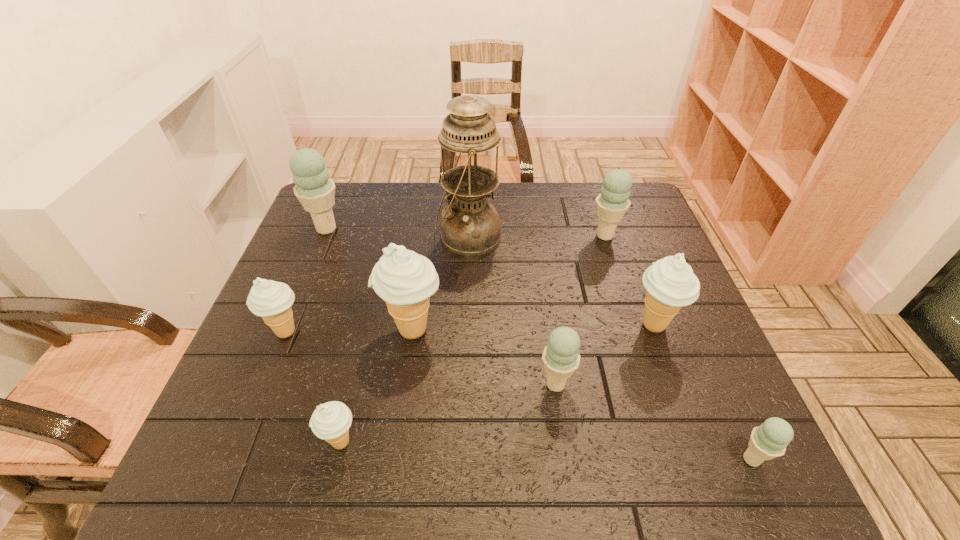
Point out which object is positioned as the sixth nearest to the oil lamp. Please provide its 2D coordinates. Your answer should be formatted as a tuple, i.e. [(x, y)], where the tuple contains the x and y coordinates of a point satisfying the conditions above.

[(561, 357)]

Identify the location of the fifth closest object to the tallest object. (271, 300).

Find the location of a particular element. This screenshot has width=960, height=540. the sixth closest ice cream to the third biggest beige icecream is located at coordinates (612, 203).

Where is `ice cream that is the fifth nearest to the third farthest blue ice cream`? Image resolution: width=960 pixels, height=540 pixels. ice cream that is the fifth nearest to the third farthest blue ice cream is located at coordinates (612, 203).

The width and height of the screenshot is (960, 540). What are the coordinates of `blue ice cream that stands as the closest to the nearest beige icecream` in the screenshot? It's located at (561, 357).

Where is `blue ice cream that is the second closest to the biggest beige icecream`? blue ice cream that is the second closest to the biggest beige icecream is located at coordinates (314, 189).

You are a GUI agent. You are given a task and a screenshot of the screen. Output one action in this format:
    pyautogui.click(x=<x>, y=<y>)
    Task: Click on the fourth closest beige icecream to the leftmost blue ice cream
    
    Given the screenshot: What is the action you would take?
    pyautogui.click(x=670, y=282)

Identify the location of the third closest beige icecream to the rightmost beige icecream. The image size is (960, 540). (271, 300).

Image resolution: width=960 pixels, height=540 pixels. I want to click on vacant region that satisfies the following two spatial constraints: 1. on the back side of the oil lamp; 2. on the left side of the second smallest beige icecream, so click(324, 237).

Find the location of a particular element. free space that satisfies the following two spatial constraints: 1. on the front side of the smallest blue ice cream; 2. on the right side of the second blue ice cream from right to left is located at coordinates (678, 459).